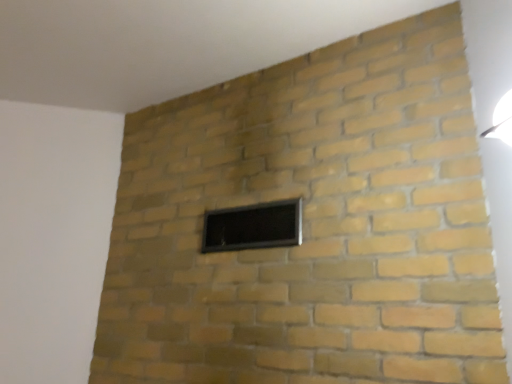
The width and height of the screenshot is (512, 384). Describe the element at coordinates (501, 120) in the screenshot. I see `white glossy light fixture at upper right` at that location.

I want to click on white glossy light fixture at upper right, so pyautogui.click(x=501, y=120).

Describe the element at coordinates (253, 226) in the screenshot. I see `black glass window at center` at that location.

You are a GUI agent. You are given a task and a screenshot of the screen. Output one action in this format:
    pyautogui.click(x=<x>, y=<y>)
    Task: Click on the black glass window at center
    The width and height of the screenshot is (512, 384).
    Given the screenshot: What is the action you would take?
    pyautogui.click(x=253, y=226)

At what (x,y) coordinates should I click in order to perform the action: click on white glossy light fixture at upper right. Please return your answer as a coordinate pair (x, y). Looking at the image, I should click on (501, 120).

Between black glass window at center and white glossy light fixture at upper right, which one appears on the right side from the viewer's perspective?

From the viewer's perspective, white glossy light fixture at upper right appears more on the right side.

Is the depth of black glass window at center less than that of white glossy light fixture at upper right?

No, the depth of black glass window at center is greater than that of white glossy light fixture at upper right.

Is point (296, 208) farther from camera compared to point (493, 118)?

That is True.

From the image's perspective, which is above, black glass window at center or white glossy light fixture at upper right?

From the image's view, white glossy light fixture at upper right is above.

From a real-world perspective, which is physically above, black glass window at center or white glossy light fixture at upper right?

white glossy light fixture at upper right.

Considering the sizes of objects black glass window at center and white glossy light fixture at upper right in the image provided, who is wider, black glass window at center or white glossy light fixture at upper right?

white glossy light fixture at upper right is wider.

Is black glass window at center taller or shorter than white glossy light fixture at upper right?

Considering their sizes, black glass window at center has more height than white glossy light fixture at upper right.

Does black glass window at center have a larger size compared to white glossy light fixture at upper right?

Incorrect, black glass window at center is not larger than white glossy light fixture at upper right.

Which is correct: black glass window at center is inside white glossy light fixture at upper right, or outside of it?

black glass window at center exists outside the volume of white glossy light fixture at upper right.

Is black glass window at center not close to white glossy light fixture at upper right?

No, there isn't a large distance between black glass window at center and white glossy light fixture at upper right.

In the scene shown: Is black glass window at center aimed at white glossy light fixture at upper right?

No, black glass window at center is not aimed at white glossy light fixture at upper right.

Looking at this image, how different are the orientations of black glass window at center and white glossy light fixture at upper right in degrees?

There is a 48.2-degree angle between the facing directions of black glass window at center and white glossy light fixture at upper right.

At what (x,y) coordinates should I click in order to perform the action: click on light fixture lying on the right of black glass window at center. Please return your answer as a coordinate pair (x, y). This screenshot has width=512, height=384. Looking at the image, I should click on (501, 120).

Which is more to the left, white glossy light fixture at upper right or black glass window at center?

Positioned to the left is black glass window at center.

Which is behind, white glossy light fixture at upper right or black glass window at center?

black glass window at center is further from the camera.

Which is closer, (494, 120) or (215, 221)?

The point (494, 120) is in front.

From the image's perspective, which object appears higher, white glossy light fixture at upper right or black glass window at center?

white glossy light fixture at upper right.

From a real-world perspective, does white glossy light fixture at upper right sit lower than black glass window at center?

No, from a real-world perspective, white glossy light fixture at upper right is not under black glass window at center.

Does white glossy light fixture at upper right have a lesser width compared to black glass window at center?

No.

Between white glossy light fixture at upper right and black glass window at center, which one has less height?

With less height is white glossy light fixture at upper right.

In the scene shown: Who is bigger, white glossy light fixture at upper right or black glass window at center?

white glossy light fixture at upper right.

Is white glossy light fixture at upper right situated inside black glass window at center or outside?

white glossy light fixture at upper right lies outside black glass window at center.

Does white glossy light fixture at upper right touch black glass window at center?

No, white glossy light fixture at upper right is not touching black glass window at center.

Could you tell me if white glossy light fixture at upper right is turned towards black glass window at center?

No, white glossy light fixture at upper right is not turned towards black glass window at center.

How much distance is there between white glossy light fixture at upper right and black glass window at center?

A distance of 34.51 inches exists between white glossy light fixture at upper right and black glass window at center.

Identify the location of light fixture on the right of the black glass window at center. (501, 120).

At what (x,y) coordinates should I click in order to perform the action: click on window on the left of white glossy light fixture at upper right. Please return your answer as a coordinate pair (x, y). Looking at the image, I should click on (253, 226).

Where is `light fixture that is above the black glass window at center (from the image's perspective)`? light fixture that is above the black glass window at center (from the image's perspective) is located at coordinates (501, 120).